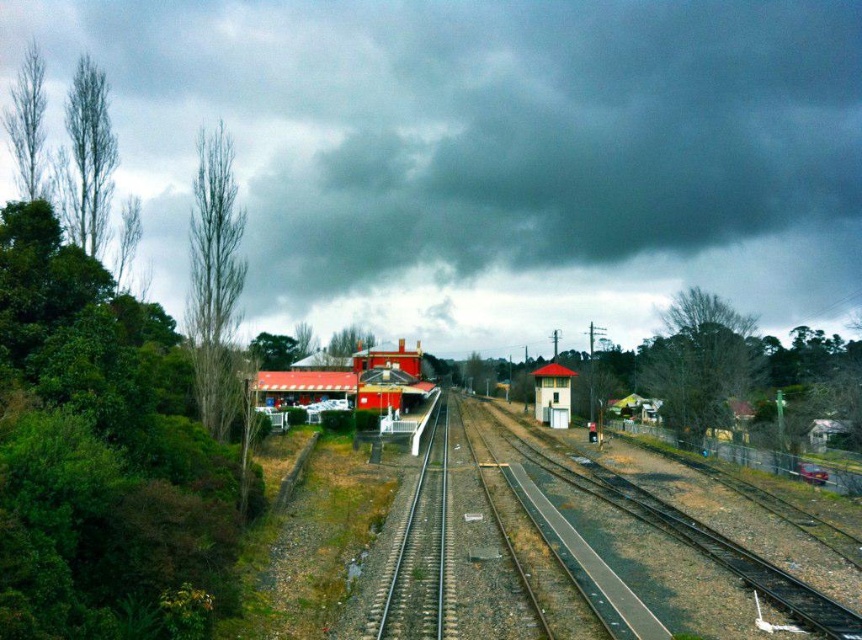
You are standing at the origin point of the image. Where is the green asphalt track at center located in relation to your position?

The green asphalt track at center is located at point 0.852 on the x axis and 0.645 on the y axis.

You are a photographer standing at the edge of the railway tracks. You want to capture a photo of the white plastic building at center without the dark gray cloud at upper center appearing in the frame. Given that your camera has a zoom lens capable of adjusting the field of view, what should you do?

The dark gray cloud at upper center is 133.56 meters away from the white plastic building at center. To avoid capturing the cloud, you should zoom in on the white plastic building at center to narrow the field of view, ensuring the distant cloud is excluded from the shot.

You are a train engineer approaching the railway station depicted in the image. You notice the dark gray cloud at upper center and the matte brick building at center. Which object is positioned higher in the scene?

The dark gray cloud at upper center is located above the matte brick building at center, so it is positioned higher in the scene.